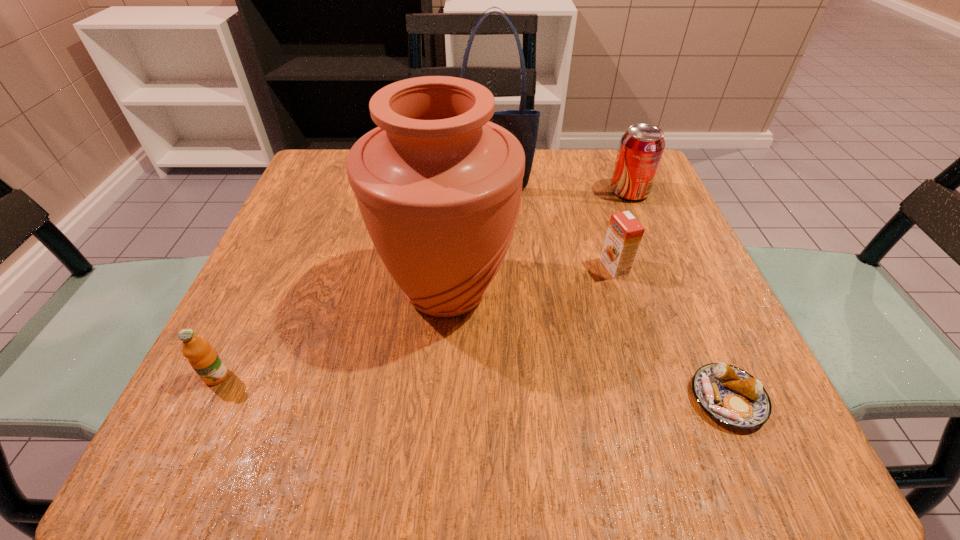
Locate which object is the third closest to the shopping bag. Please provide its 2D coordinates. Your answer should be formatted as a tuple, i.e. [(x, y)], where the tuple contains the x and y coordinates of a point satisfying the conditions above.

[(624, 234)]

Identify the location of object that is the closest to the fourth object from left to right. (439, 186).

I want to click on blank space that satisfies the following two spatial constraints: 1. on the front-facing side of the shopping bag; 2. on the left side of the pastry, so coord(498,399).

You are a GUI agent. You are given a task and a screenshot of the screen. Output one action in this format:
    pyautogui.click(x=<x>, y=<y>)
    Task: Click on the vacant region that satisfies the following two spatial constraints: 1. on the label of the left orange juice; 2. on the left side of the pastry
    
    Given the screenshot: What is the action you would take?
    pyautogui.click(x=205, y=399)

You are a GUI agent. You are given a task and a screenshot of the screen. Output one action in this format:
    pyautogui.click(x=<x>, y=<y>)
    Task: Click on the free space that satisfies the following two spatial constraints: 1. on the label of the left orange juice; 2. on the left side of the shortest object
    The width and height of the screenshot is (960, 540).
    Given the screenshot: What is the action you would take?
    pyautogui.click(x=205, y=399)

Where is `vacant area that satisfies the following two spatial constraints: 1. on the front-facing side of the farther orange juice; 2. on the right side of the shopping bag`? The height and width of the screenshot is (540, 960). vacant area that satisfies the following two spatial constraints: 1. on the front-facing side of the farther orange juice; 2. on the right side of the shopping bag is located at coordinates (493, 267).